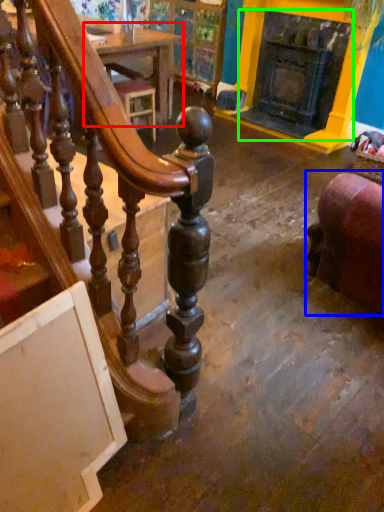
Question: Which is nearer to the table (highlighted by a red box)? furniture (highlighted by a blue box) or fireplace (highlighted by a green box).

Choices:
 (A) furniture
 (B) fireplace

Answer: (B)